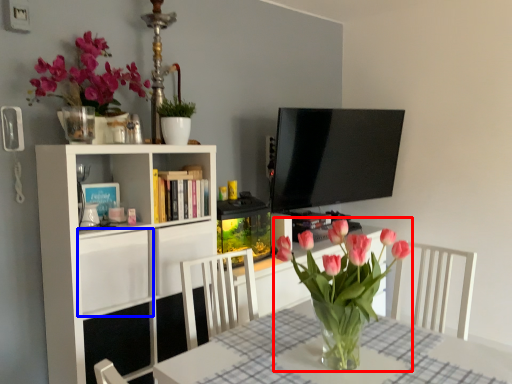
Question: Which object is further to the camera taking this photo, floral arrangement (highlighted by a red box) or cabinet (highlighted by a blue box)?

Choices:
 (A) floral arrangement
 (B) cabinet

Answer: (B)